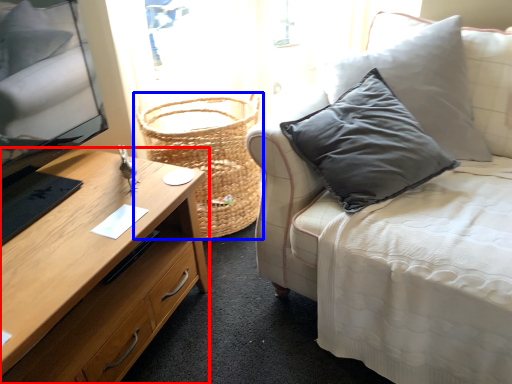
Question: Which of the following is the closest to the observer, desk (highlighted by a red box) or basket (highlighted by a blue box)?

Choices:
 (A) desk
 (B) basket

Answer: (A)